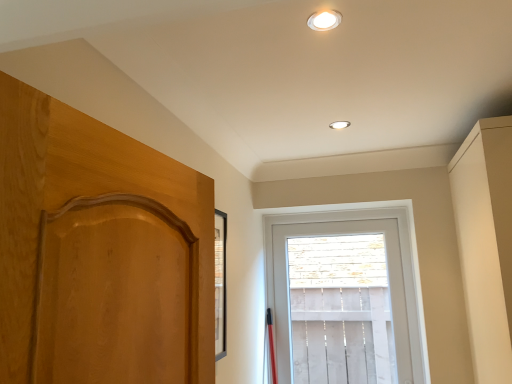
What is the approximate width of white glossy light fixture at upper center, which ranks as the second lighting in top-to-bottom order?

The width of white glossy light fixture at upper center, which ranks as the second lighting in top-to-bottom order, is 3.72 inches.

From the picture: How much space does white glossy light fixture at upper center, which ranks as the second lighting in top-to-bottom order, occupy vertically?

The height of white glossy light fixture at upper center, which ranks as the second lighting in top-to-bottom order, is 0.68 inches.

What is the approximate height of white glossy recessed light at upper center, which is counted as the second lighting, starting from the bottom?

It is 0.61 inches.

Describe the element at coordinates (324, 20) in the screenshot. This screenshot has width=512, height=384. I see `white glossy recessed light at upper center, the second lighting when ordered from right to left` at that location.

The height and width of the screenshot is (384, 512). I want to click on matte beige dresser at right, so click(486, 243).

Locate an element on the screen. This screenshot has width=512, height=384. white glossy light fixture at upper center, which appears as the first lighting when viewed from the back is located at coordinates (339, 125).

Between matte beige dresser at right and white glossy recessed light at upper center, which is counted as the second lighting, starting from the bottom, which one has larger size?

matte beige dresser at right is bigger.

This screenshot has width=512, height=384. What are the coordinates of `dresser below the white glossy recessed light at upper center, arranged as the second lighting when viewed from the back (from the image's perspective)` in the screenshot? It's located at (486, 243).

From the picture: Can you tell me how much matte beige dresser at right and white glossy recessed light at upper center, the second lighting when ordered from right to left, differ in facing direction?

The angle between the facing direction of matte beige dresser at right and the facing direction of white glossy recessed light at upper center, the second lighting when ordered from right to left, is 95.8 degrees.

In the image, is matte beige dresser at right positioned in front of or behind white glossy recessed light at upper center, arranged as the second lighting when viewed from the back?

Clearly, matte beige dresser at right is behind white glossy recessed light at upper center, arranged as the second lighting when viewed from the back.

Is matte beige dresser at right next to white wooden window at center?

No, matte beige dresser at right is not with white wooden window at center.

Can you confirm if matte beige dresser at right is bigger than white wooden window at center?

Yes.

Consider the image. Considering the sizes of objects matte beige dresser at right and white wooden window at center in the image provided, who is shorter, matte beige dresser at right or white wooden window at center?

With less height is white wooden window at center.

From the image's perspective, is matte beige dresser at right beneath white wooden window at center?

Incorrect, from the image's perspective, matte beige dresser at right is higher than white wooden window at center.

In terms of size, does white glossy light fixture at upper center, the second lighting positioned from the left, appear bigger or smaller than matte beige dresser at right?

In the image, white glossy light fixture at upper center, the second lighting positioned from the left, appears to be smaller than matte beige dresser at right.

Can matte beige dresser at right be found inside white glossy light fixture at upper center, acting as the first lighting starting from the right?

That's incorrect, matte beige dresser at right is not inside white glossy light fixture at upper center, acting as the first lighting starting from the right.

Which object is closer to the camera, white glossy light fixture at upper center, which ranks as the second lighting in top-to-bottom order, or matte beige dresser at right?

matte beige dresser at right is in front.

Is there a large distance between white glossy light fixture at upper center, which ranks as the second lighting in top-to-bottom order, and matte beige dresser at right?

That's not correct — white glossy light fixture at upper center, which ranks as the second lighting in top-to-bottom order, is a little close to matte beige dresser at right.

Does white glossy recessed light at upper center, the second lighting when ordered from right to left, appear on the right side of matte beige dresser at right?

No.

Is white glossy recessed light at upper center, which is counted as the second lighting, starting from the bottom, oriented towards matte beige dresser at right?

No, white glossy recessed light at upper center, which is counted as the second lighting, starting from the bottom, is not facing towards matte beige dresser at right.

From a real-world perspective, relative to matte beige dresser at right, is white glossy recessed light at upper center, which is counted as the second lighting, starting from the bottom, vertically above or below?

From a real-world perspective, white glossy recessed light at upper center, which is counted as the second lighting, starting from the bottom, is physically above matte beige dresser at right.

Is point (317, 28) more distant than point (509, 264)?

No.

From a real-world perspective, who is located lower, white wooden window at center or matte beige dresser at right?

From a 3D spatial view, white wooden window at center is below.

Consider the image. Can you confirm if white wooden window at center is positioned to the right of matte beige dresser at right?

Incorrect, white wooden window at center is not on the right side of matte beige dresser at right.

In terms of height, does white wooden window at center look taller or shorter compared to matte beige dresser at right?

In the image, white wooden window at center appears to be shorter than matte beige dresser at right.

Which object is thinner, white wooden window at center or matte beige dresser at right?

Thinner between the two is white wooden window at center.

Would you say white wooden window at center is outside white glossy recessed light at upper center, which ranks as the 1th lighting in left-to-right order?

Yes, white wooden window at center is located beyond the bounds of white glossy recessed light at upper center, which ranks as the 1th lighting in left-to-right order.

Is white wooden window at center not near white glossy recessed light at upper center, arranged as the second lighting when viewed from the back?

Yes, white wooden window at center and white glossy recessed light at upper center, arranged as the second lighting when viewed from the back, are quite far apart.

Is white glossy recessed light at upper center, which ranks as the 1th lighting in left-to-right order, at the back of white wooden window at center?

No, white wooden window at center is not facing away from white glossy recessed light at upper center, which ranks as the 1th lighting in left-to-right order.

Is white wooden window at center taller than white glossy recessed light at upper center, arranged as the second lighting when viewed from the back?

Correct, white wooden window at center is much taller as white glossy recessed light at upper center, arranged as the second lighting when viewed from the back.

Considering the positions of objects white glossy light fixture at upper center, which ranks as the second lighting in top-to-bottom order, and white wooden window at center in the image provided, who is more to the left, white glossy light fixture at upper center, which ranks as the second lighting in top-to-bottom order, or white wooden window at center?

white glossy light fixture at upper center, which ranks as the second lighting in top-to-bottom order, is more to the left.

Is white glossy light fixture at upper center, the second lighting positioned from the left, looking in the opposite direction of white wooden window at center?

No, white glossy light fixture at upper center, the second lighting positioned from the left, is not facing the opposite direction of white wooden window at center.

Is the position of white glossy light fixture at upper center, which appears as the first lighting when viewed from the back, more distant than that of white wooden window at center?

That is False.

Is white glossy light fixture at upper center, which appears as the first lighting when ordered from the bottom, smaller than white wooden window at center?

Indeed, white glossy light fixture at upper center, which appears as the first lighting when ordered from the bottom, has a smaller size compared to white wooden window at center.

Where is `dresser on the right of white glossy recessed light at upper center, arranged as the 1th lighting when viewed from the top`? The image size is (512, 384). dresser on the right of white glossy recessed light at upper center, arranged as the 1th lighting when viewed from the top is located at coordinates (486, 243).

The width and height of the screenshot is (512, 384). What are the coordinates of `window below the matte beige dresser at right (from the image's perspective)` in the screenshot? It's located at (401, 263).

Looking at the image, which one is located further to white wooden window at center, white glossy light fixture at upper center, which ranks as the second lighting in top-to-bottom order, or white glossy recessed light at upper center, which ranks as the 1th lighting in left-to-right order?

Among the two, white glossy recessed light at upper center, which ranks as the 1th lighting in left-to-right order, is located further to white wooden window at center.

Looking at the image, which one is located further to white glossy recessed light at upper center, the 1th lighting positioned from the front, white glossy light fixture at upper center, which ranks as the second lighting in top-to-bottom order, or white wooden window at center?

white wooden window at center lies further to white glossy recessed light at upper center, the 1th lighting positioned from the front, than the other object.

From the image, which object appears to be nearer to white glossy light fixture at upper center, the second lighting positioned from the left, matte beige dresser at right or white wooden window at center?

matte beige dresser at right.

Looking at the image, which one is located closer to white glossy recessed light at upper center, arranged as the second lighting when viewed from the back, white wooden window at center or white glossy light fixture at upper center, the second lighting positioned from the left?

white glossy light fixture at upper center, the second lighting positioned from the left, lies closer to white glossy recessed light at upper center, arranged as the second lighting when viewed from the back, than the other object.

From the image, which object appears to be farther from white glossy light fixture at upper center, which appears as the first lighting when viewed from the back, matte beige dresser at right or white glossy recessed light at upper center, which ranks as the 1th lighting in left-to-right order?

Among the two, matte beige dresser at right is located further to white glossy light fixture at upper center, which appears as the first lighting when viewed from the back.

Looking at the image, which one is located closer to white wooden window at center, white glossy recessed light at upper center, the 1th lighting positioned from the front, or matte beige dresser at right?

matte beige dresser at right.

From the image, which object appears to be farther from matte beige dresser at right, white wooden window at center or white glossy recessed light at upper center, arranged as the 1th lighting when viewed from the top?

white glossy recessed light at upper center, arranged as the 1th lighting when viewed from the top, is positioned further to the anchor matte beige dresser at right.

From the image, which object appears to be farther from white wooden window at center, matte beige dresser at right or white glossy light fixture at upper center, which appears as the first lighting when ordered from the bottom?

Among the two, white glossy light fixture at upper center, which appears as the first lighting when ordered from the bottom, is located further to white wooden window at center.

The width and height of the screenshot is (512, 384). I want to click on lighting between white glossy recessed light at upper center, which ranks as the 1th lighting in left-to-right order, and matte beige dresser at right, in the horizontal direction, so click(339, 125).

The width and height of the screenshot is (512, 384). Find the location of `lighting between matte beige dresser at right and white wooden window at center in the front-back direction`. lighting between matte beige dresser at right and white wooden window at center in the front-back direction is located at coordinates (339, 125).

Find the location of `dresser between white glossy recessed light at upper center, which ranks as the 1th lighting in left-to-right order, and white wooden window at center, along the z-axis`. dresser between white glossy recessed light at upper center, which ranks as the 1th lighting in left-to-right order, and white wooden window at center, along the z-axis is located at coordinates (486, 243).

This screenshot has height=384, width=512. Identify the location of lighting between white glossy recessed light at upper center, which is counted as the second lighting, starting from the bottom, and white wooden window at center in the front-back direction. (339, 125).